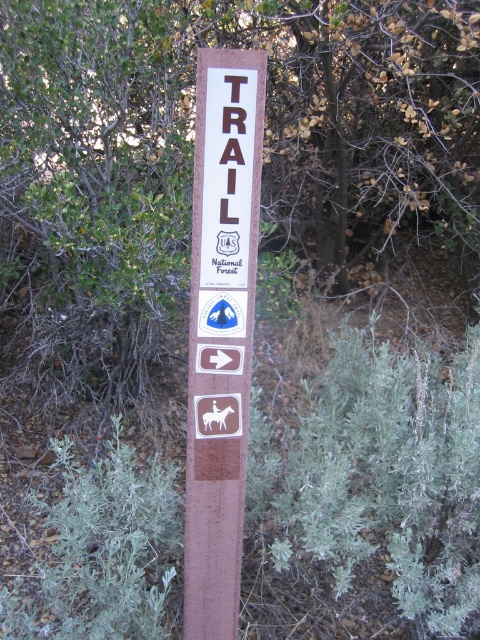
Question: Can you confirm if green leafy tree at center is thinner than brown wood trail sign at center?

Choices:
 (A) no
 (B) yes

Answer: (A)

Question: Which of the following is the closest to the observer?

Choices:
 (A) (20, 99)
 (B) (205, 202)

Answer: (B)

Question: Is green leafy tree at center behind brown wood trail sign at center?

Choices:
 (A) yes
 (B) no

Answer: (A)

Question: Can you confirm if green leafy tree at center is positioned to the right of brown wood trail sign at center?

Choices:
 (A) yes
 (B) no

Answer: (A)

Question: Which point appears closest to the camera in this image?

Choices:
 (A) (83, 205)
 (B) (184, 627)

Answer: (B)